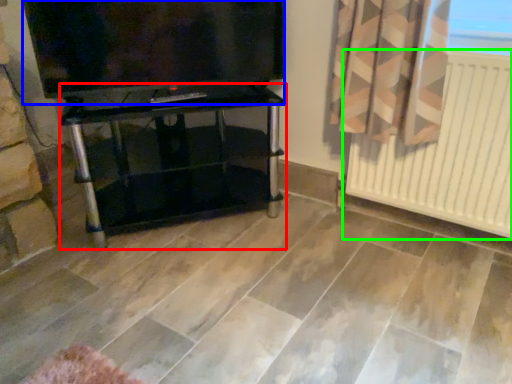
Question: Based on their relative distances, which object is farther from furniture (highlighted by a red box)? Choose from television (highlighted by a blue box) and radiator (highlighted by a green box).

Choices:
 (A) television
 (B) radiator

Answer: (B)